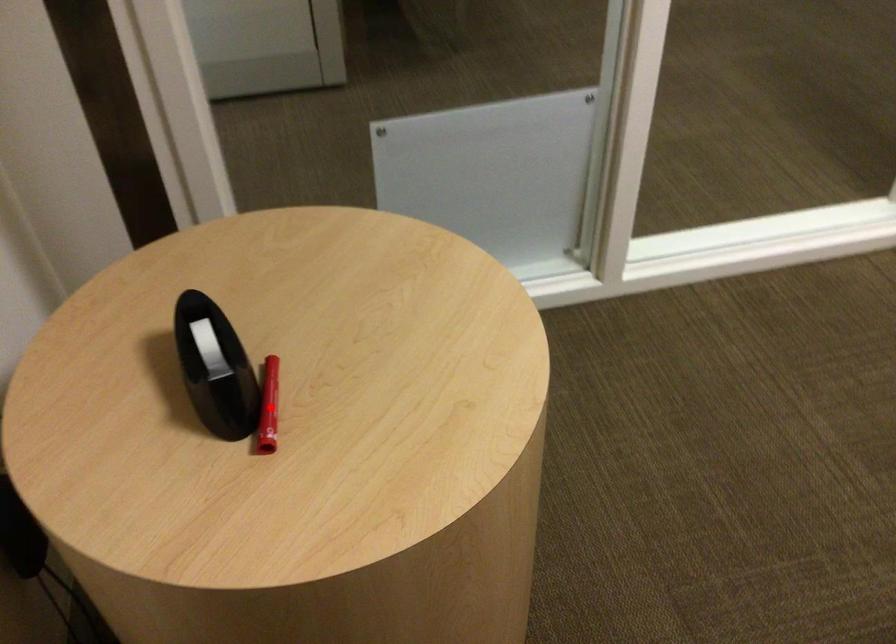
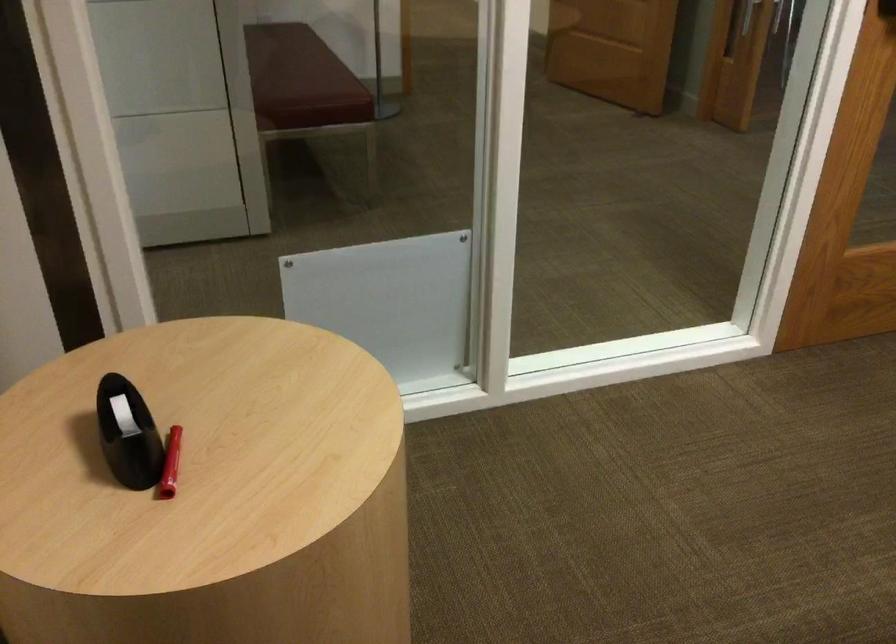
Question: I am providing you with two images of the same scene from different viewpoints. Given a red point in image1, look at the same physical point in image2. Is it:

Choices:
 (A) Closer to the viewpoint
 (B) Farther from the viewpoint

Answer: (B)